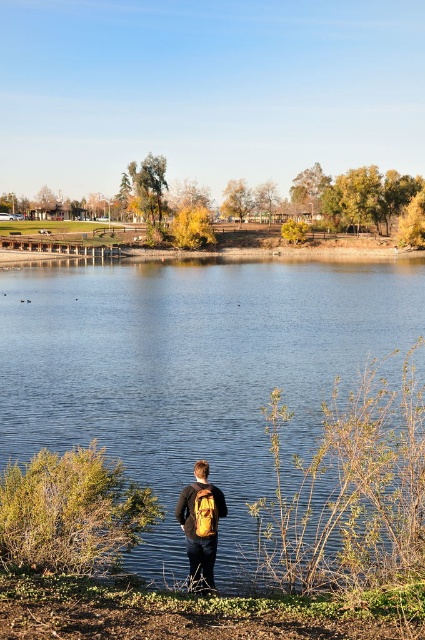
Question: Is blue smooth water at center to the left of matte yellow backpack at center from the viewer's perspective?

Choices:
 (A) yes
 (B) no

Answer: (B)

Question: Which point is closer to the camera?

Choices:
 (A) pos(201,531)
 (B) pos(286,305)

Answer: (A)

Question: Among these points, which one is nearest to the camera?

Choices:
 (A) (291, 273)
 (B) (204, 484)

Answer: (B)

Question: Among these points, which one is nearest to the camera?

Choices:
 (A) (204, 522)
 (B) (189, 362)

Answer: (A)

Question: Considering the relative positions of blue smooth water at center and matte yellow backpack at center in the image provided, where is blue smooth water at center located with respect to matte yellow backpack at center?

Choices:
 (A) right
 (B) left

Answer: (A)

Question: Observing the image, what is the correct spatial positioning of blue smooth water at center in reference to matte yellow backpack at center?

Choices:
 (A) above
 (B) below

Answer: (A)